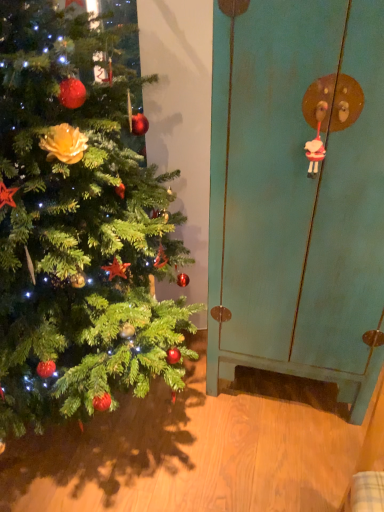
What do you see at coordinates (298, 194) in the screenshot?
I see `teal matte cabinet at right` at bounding box center [298, 194].

What is the approximate height of green matte christmas tree at left?

The height of green matte christmas tree at left is 5.18 feet.

What is the approximate width of white glossy sheep at upper right?

white glossy sheep at upper right is 1.96 inches in width.

Find the location of a particular element. white glossy sheep at upper right is located at coordinates (x=316, y=134).

Locate an element on the screen. teal matte cabinet at right is located at coordinates (298, 194).

Considering the sizes of objects teal matte cabinet at right and green matte christmas tree at left in the image provided, who is shorter, teal matte cabinet at right or green matte christmas tree at left?

With less height is green matte christmas tree at left.

Which object is thinner, teal matte cabinet at right or green matte christmas tree at left?

teal matte cabinet at right.

Is point (355, 123) positioned after point (62, 92)?

Yes, it is.

From a real-world perspective, relative to green matte christmas tree at left, is teal matte cabinet at right vertically above or below?

teal matte cabinet at right is below green matte christmas tree at left.

Considering the points (364, 36) and (320, 131), which point is in front, point (364, 36) or point (320, 131)?

The point (364, 36) is closer.

The height and width of the screenshot is (512, 384). I want to click on screen door lying on the right of white glossy sheep at upper right, so click(x=298, y=194).

From their relative heights in the image, would you say teal matte cabinet at right is taller or shorter than white glossy sheep at upper right?

Answer: In the image, teal matte cabinet at right appears to be taller than white glossy sheep at upper right.

Which object is closer to the camera taking this photo, teal matte cabinet at right or white glossy sheep at upper right?

teal matte cabinet at right is more forward.

Which object is positioned more to the right, green matte christmas tree at left or white glossy sheep at upper right?

white glossy sheep at upper right.

You are a GUI agent. You are given a task and a screenshot of the screen. Output one action in this format:
    pyautogui.click(x=<x>, y=<y>)
    Task: Click on the christmas tree below the white glossy sheep at upper right (from a real-world perspective)
    Image resolution: width=384 pixels, height=512 pixels.
    Given the screenshot: What is the action you would take?
    pyautogui.click(x=77, y=228)

Is point (47, 369) less distant than point (324, 100)?

No, (47, 369) is behind (324, 100).

Which object is positioned more to the left, green matte christmas tree at left or teal matte cabinet at right?

From the viewer's perspective, green matte christmas tree at left appears more on the left side.

How different are the orientations of green matte christmas tree at left and teal matte cabinet at right in degrees?

The angle between the facing direction of green matte christmas tree at left and the facing direction of teal matte cabinet at right is 1.35 degrees.

Between green matte christmas tree at left and teal matte cabinet at right, which one has larger size?

With larger size is green matte christmas tree at left.

Is green matte christmas tree at left wider or thinner than teal matte cabinet at right?

In the image, green matte christmas tree at left appears to be wider than teal matte cabinet at right.

Considering the relative sizes of white glossy sheep at upper right and green matte christmas tree at left in the image provided, is white glossy sheep at upper right shorter than green matte christmas tree at left?

Yes, white glossy sheep at upper right is shorter than green matte christmas tree at left.

From the image's perspective, between white glossy sheep at upper right and green matte christmas tree at left, who is located below?

From the image's view, green matte christmas tree at left is below.

Considering the relative positions of white glossy sheep at upper right and green matte christmas tree at left in the image provided, is white glossy sheep at upper right in front of green matte christmas tree at left?

No, it is behind green matte christmas tree at left.

Consider the image. What's the angular difference between white glossy sheep at upper right and green matte christmas tree at left's facing directions?

There is a 1.36-degree angle between the facing directions of white glossy sheep at upper right and green matte christmas tree at left.

Considering the positions of points (322, 103) and (302, 216), is point (322, 103) closer to camera compared to point (302, 216)?

Yes, it is in front of point (302, 216).

Considering the relative sizes of white glossy sheep at upper right and teal matte cabinet at right in the image provided, is white glossy sheep at upper right taller than teal matte cabinet at right?

No.

Is white glossy sheep at upper right not inside teal matte cabinet at right?

No, white glossy sheep at upper right is inside teal matte cabinet at right's boundary.

You are a GUI agent. You are given a task and a screenshot of the screen. Output one action in this format:
    pyautogui.click(x=<x>, y=<y>)
    Task: Click on the christmas tree on the left side of teal matte cabinet at right
    The image size is (384, 512).
    Given the screenshot: What is the action you would take?
    pyautogui.click(x=77, y=228)

Where is `toy that is above the teal matte cabinet at right (from the image's perspective)`? toy that is above the teal matte cabinet at right (from the image's perspective) is located at coordinates (316, 134).

Considering their positions, is teal matte cabinet at right positioned closer to green matte christmas tree at left than white glossy sheep at upper right?

teal matte cabinet at right is closer to green matte christmas tree at left.

Estimate the real-world distances between objects in this image. Which object is closer to teal matte cabinet at right, green matte christmas tree at left or white glossy sheep at upper right?

The object closer to teal matte cabinet at right is white glossy sheep at upper right.

Considering their positions, is white glossy sheep at upper right positioned closer to green matte christmas tree at left than teal matte cabinet at right?

teal matte cabinet at right is positioned closer to the anchor green matte christmas tree at left.

Estimate the real-world distances between objects in this image. Which object is closer to white glossy sheep at upper right, green matte christmas tree at left or teal matte cabinet at right?

teal matte cabinet at right lies closer to white glossy sheep at upper right than the other object.

Based on the photo, considering their positions, is teal matte cabinet at right positioned closer to white glossy sheep at upper right than green matte christmas tree at left?

teal matte cabinet at right.

Which object lies further to the anchor point teal matte cabinet at right, white glossy sheep at upper right or green matte christmas tree at left?

green matte christmas tree at left.

Locate an element on the screen. The image size is (384, 512). toy between green matte christmas tree at left and teal matte cabinet at right from left to right is located at coordinates (316, 134).